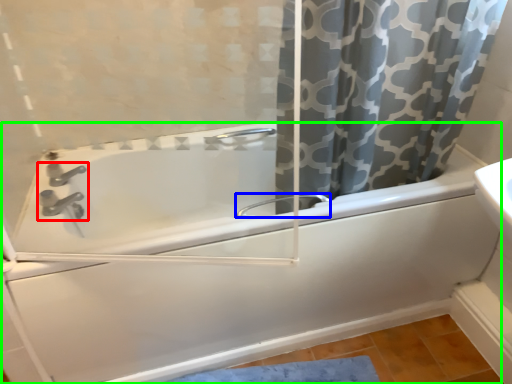
Question: Based on their relative distances, which object is farther from tap (highlighted by a red box)? Choose from faucet (highlighted by a blue box) and bathtub (highlighted by a green box).

Choices:
 (A) faucet
 (B) bathtub

Answer: (A)